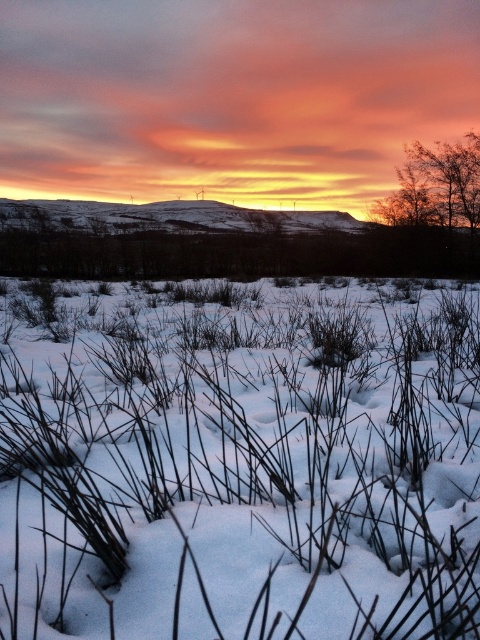
How distant is brown dry grass at lower center from brown textured tree at upper right?

brown dry grass at lower center is 27.27 meters from brown textured tree at upper right.

Does brown dry grass at lower center appear on the left side of brown textured tree at upper right?

Correct, you'll find brown dry grass at lower center to the left of brown textured tree at upper right.

Image resolution: width=480 pixels, height=640 pixels. What are the coordinates of `brown dry grass at lower center` in the screenshot? It's located at (242, 465).